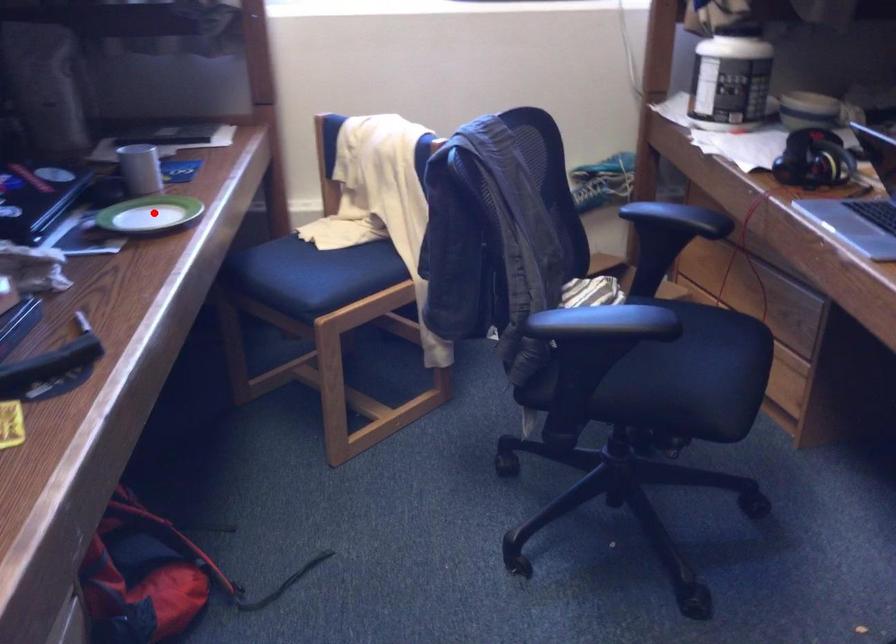
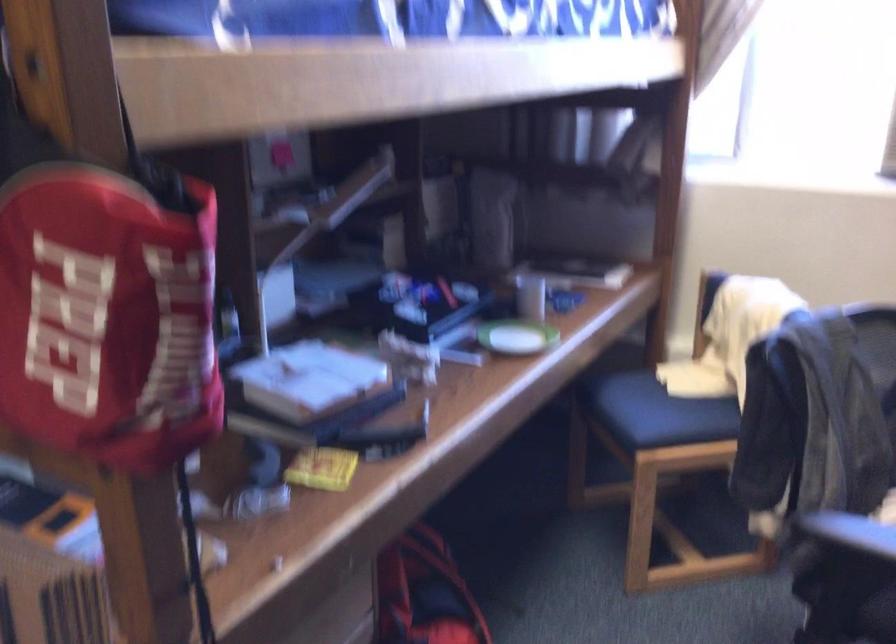
Question: I am providing you with two images of the same scene from different viewpoints. Given a red point in image1, look at the same physical point in image2. Is it:

Choices:
 (A) Closer to the viewpoint
 (B) Farther from the viewpoint

Answer: (B)